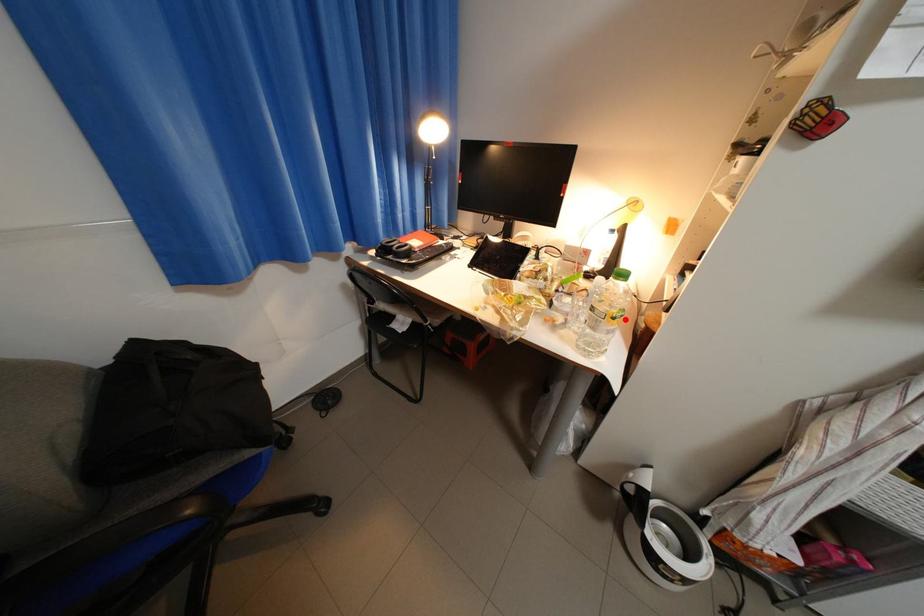
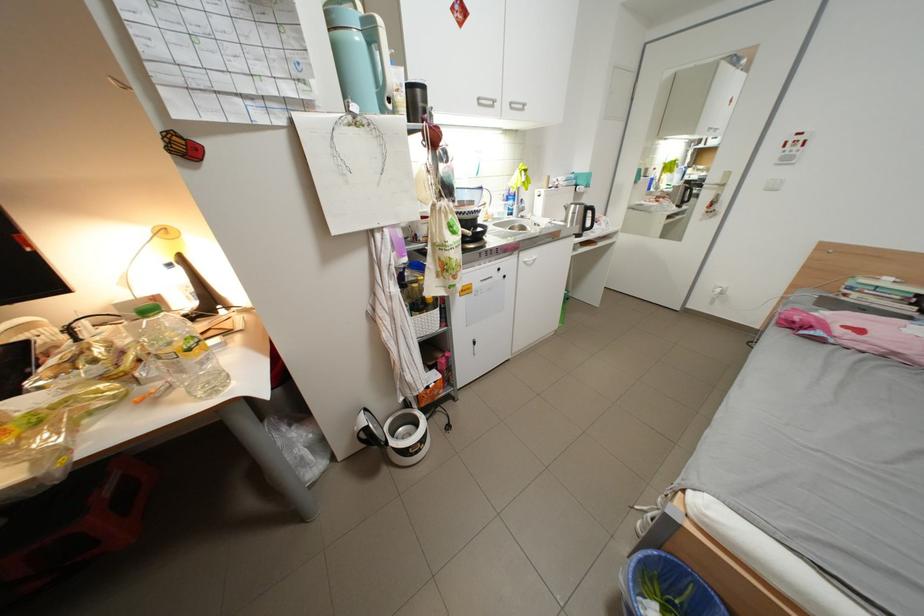
The point at the highlighted location is marked in the first image. Where is the corresponding point in the second image?

(201, 351)